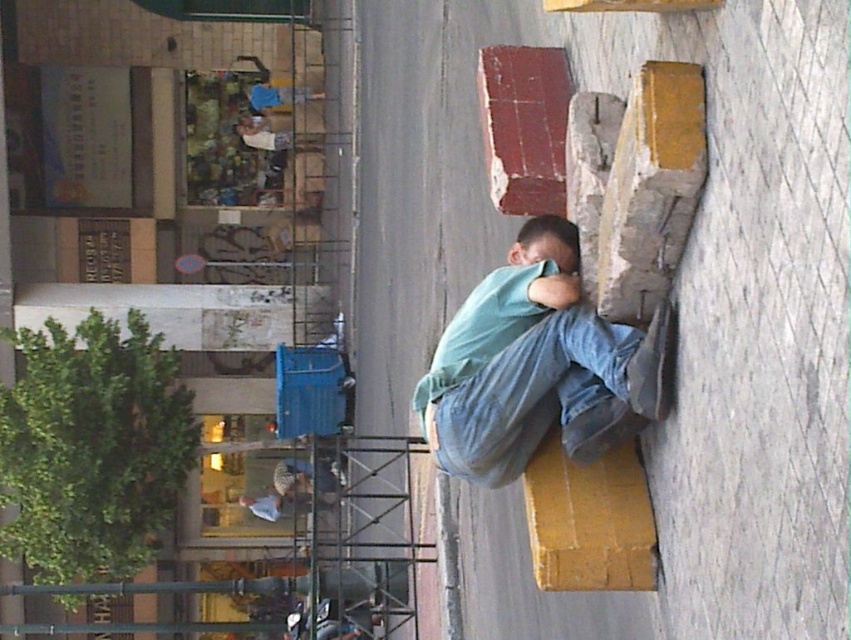
You are a fashion designer observing the urban scene. You notice denim at right and light blue denim pants at lower center. Which piece of clothing is positioned more to the right in the image?

Denim at right is positioned more to the right in the image than light blue denim pants at lower center.